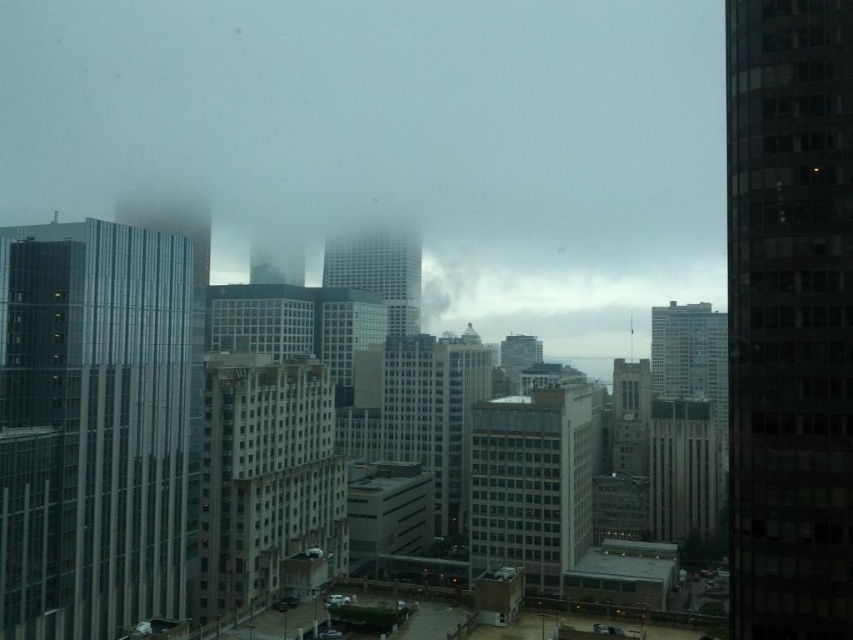
You are standing on the observation deck of a tall building and looking out at the city. You notice a point marked at coordinates (93,428). Based on the description, what type of building is located at that point?

The point at (93,428) indicates a glassy reflective skyscraper at left.

You are standing on a rooftop and want to take a photo of the glassy reflective skyscraper at left. If your camera can capture objects up to 100 meters away, will you be able to take a clear photo?

The glassy reflective skyscraper at left and camera are 93.03 meters apart. Since the camera can capture up to 100 meters, you can take a clear photo.

You are standing on a balcony overlooking the city. You see the dark glass skyscraper at right and the gray concrete building at center. Which building do you have to look upward to see?

You have to look upward to see the gray concrete building at center because it is farther away than the dark glass skyscraper at right, so it appears higher in the visual field.